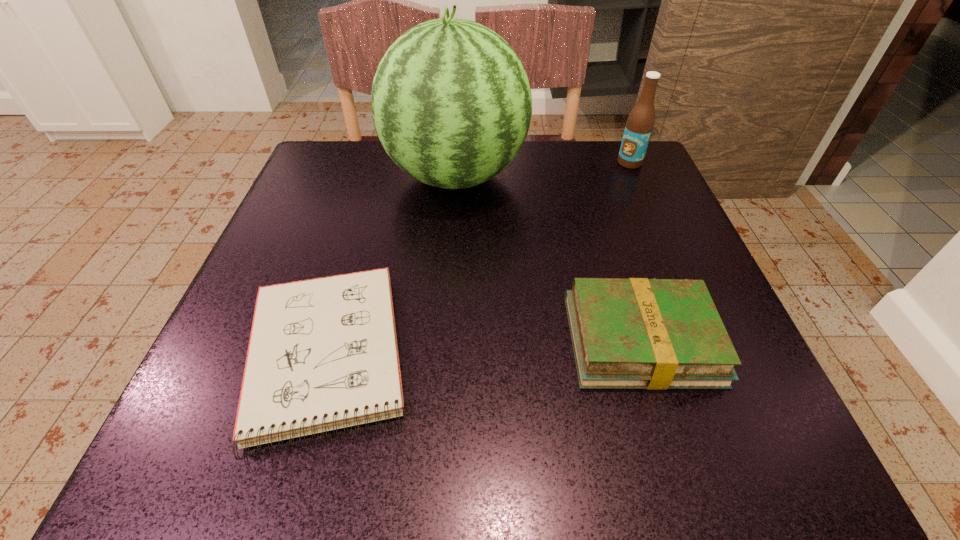
Locate an element on the screen. The height and width of the screenshot is (540, 960). watermelon is located at coordinates (451, 102).

This screenshot has width=960, height=540. I want to click on the second tallest object, so click(x=640, y=122).

The height and width of the screenshot is (540, 960). What are the coordinates of `the second shortest object` in the screenshot? It's located at (637, 333).

Where is `notepad`? The image size is (960, 540). notepad is located at coordinates (323, 354).

You are a GUI agent. You are given a task and a screenshot of the screen. Output one action in this format:
    pyautogui.click(x=<x>, y=<y>)
    Task: Click on the vacant space located on the front of the watermelon
    
    Given the screenshot: What is the action you would take?
    pyautogui.click(x=450, y=258)

In order to click on vacant space situated on the left of the second tallest object in this screenshot , I will do `click(571, 163)`.

Where is `vacant area situated 0.050m on the front of the second shortest object`? vacant area situated 0.050m on the front of the second shortest object is located at coordinates (666, 423).

I want to click on vacant space situated on the right of the shortest object, so click(x=602, y=354).

Image resolution: width=960 pixels, height=540 pixels. I want to click on watermelon that is at the far edge, so click(451, 102).

At what (x,y) coordinates should I click in order to perform the action: click on beer bottle that is at the far edge. Please return your answer as a coordinate pair (x, y). The width and height of the screenshot is (960, 540). Looking at the image, I should click on (640, 122).